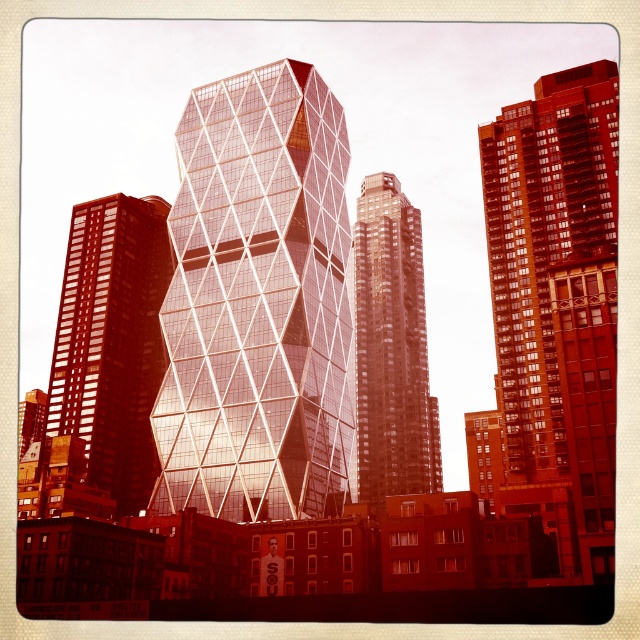
Is glassy reflective building at center shorter than matte glass tower at left?

Incorrect, glassy reflective building at center's height does not fall short of matte glass tower at left's.

Who is taller, glassy reflective building at center or matte glass tower at left?

With more height is glassy reflective building at center.

Describe the element at coordinates (257, 304) in the screenshot. I see `glassy reflective building at center` at that location.

At what (x,y) coordinates should I click in order to perform the action: click on glassy reflective building at center. Please return your answer as a coordinate pair (x, y). Looking at the image, I should click on (257, 304).

Does matte glass building at right come in front of matte glass tower at left?

That is True.

Is point (577, 465) closer to camera compared to point (90, 243)?

Yes, point (577, 465) is closer to viewer.

At what (x,y) coordinates should I click in order to perform the action: click on matte glass building at right. Please return your answer as a coordinate pair (x, y). The image size is (640, 640). Looking at the image, I should click on (557, 301).

This screenshot has width=640, height=640. What do you see at coordinates (113, 342) in the screenshot? I see `matte glass tower at left` at bounding box center [113, 342].

Is point (140, 260) behind point (406, 452)?

No, (140, 260) is in front of (406, 452).

The image size is (640, 640). What are the coordinates of `matte glass tower at left` in the screenshot? It's located at (113, 342).